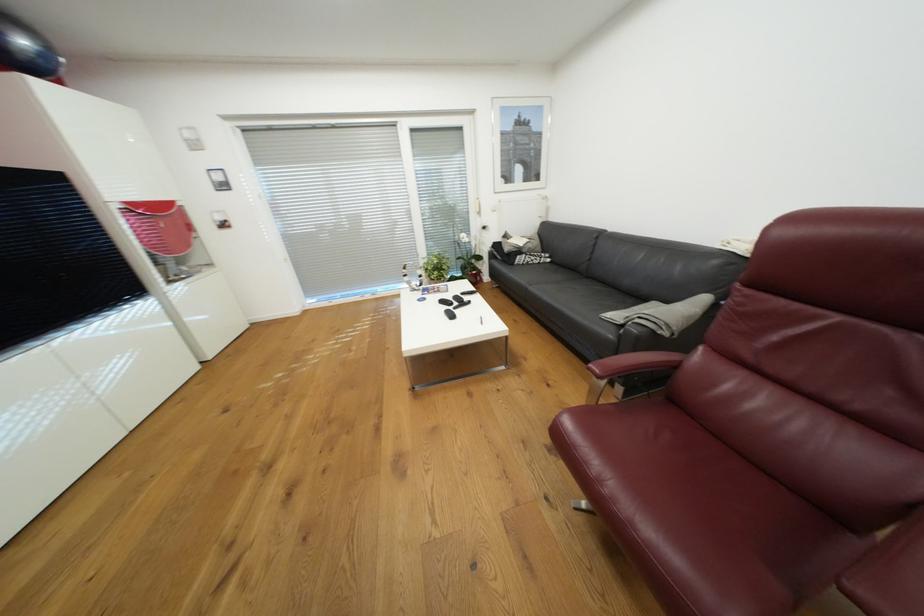
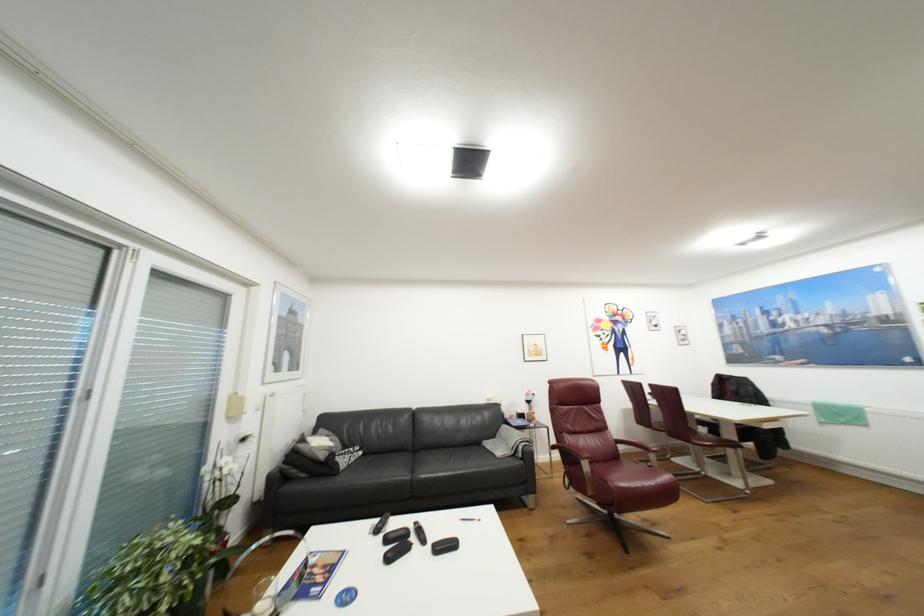
In the second image, find the point that corresponds to the point at 513,236 in the first image.

(309, 440)